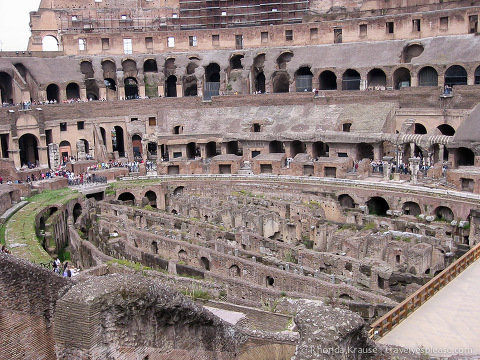
Locate an element on the screen. The width and height of the screenshot is (480, 360). first floor arches is located at coordinates (30, 153), (62, 151), (155, 149), (138, 151), (276, 145), (230, 147), (212, 153).